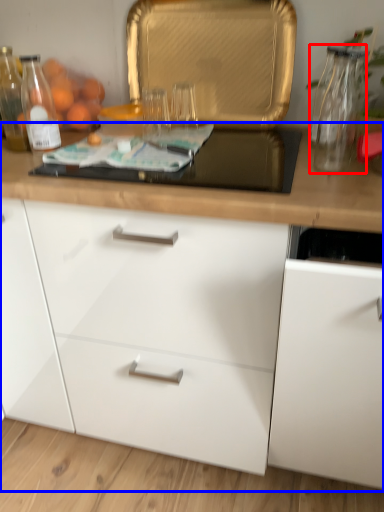
Question: Which object appears farthest to the camera in this image, glass vase (highlighted by a red box) or cabinetry (highlighted by a blue box)?

Choices:
 (A) glass vase
 (B) cabinetry

Answer: (A)